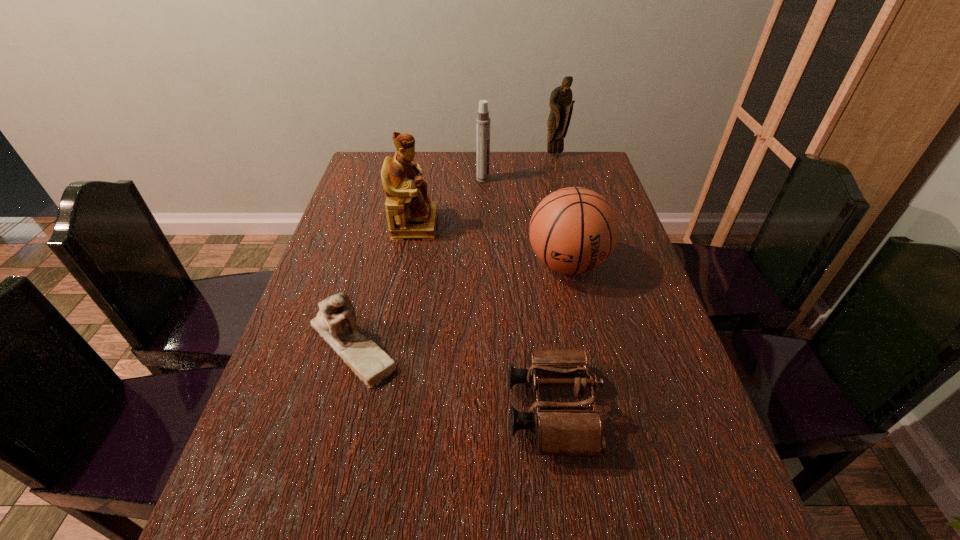
Locate an element on the screen. free point between the nearest figurine and the second farthest figurine is located at coordinates (383, 284).

Find the location of a particular element. The width and height of the screenshot is (960, 540). free spot between the binoculars and the second shortest object is located at coordinates (452, 377).

Locate an element on the screen. This screenshot has height=540, width=960. vacant space that is in between the shortest object and the second farthest figurine is located at coordinates (483, 317).

Identify the location of vacant space that is in between the fifth nearest object and the farthest figurine. (519, 167).

The height and width of the screenshot is (540, 960). I want to click on free point between the fifth tallest object and the binoculars, so click(x=452, y=377).

The width and height of the screenshot is (960, 540). Identify the location of free space between the binoculars and the second farthest figurine. (483, 317).

Identify which object is the fifth nearest to the shortest figurine. Please provide its 2D coordinates. Your answer should be formatted as a tuple, i.e. [(x, y)], where the tuple contains the x and y coordinates of a point satisfying the conditions above.

[(561, 104)]

The height and width of the screenshot is (540, 960). Identify the location of object that is the fourth closest one to the nearest figurine. (482, 121).

At what (x,y) coordinates should I click in order to perform the action: click on figurine identified as the second closest to the farthest object. Please return your answer as a coordinate pair (x, y). The height and width of the screenshot is (540, 960). Looking at the image, I should click on (335, 322).

Choose which figurine is the nearest neighbor to the second nearest figurine. Please provide its 2D coordinates. Your answer should be formatted as a tuple, i.e. [(x, y)], where the tuple contains the x and y coordinates of a point satisfying the conditions above.

[(335, 322)]